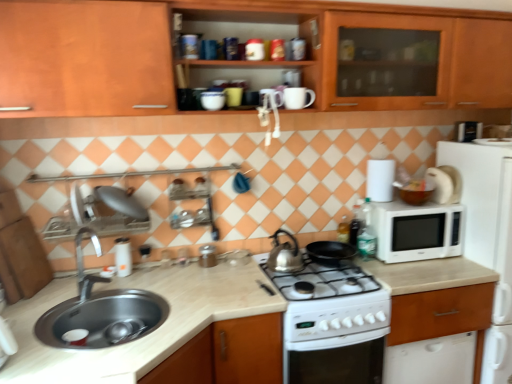
Identify the location of vacant point to the right of metallic silver canister at center, which is counted as the 2th appliance, starting from the left. The image size is (512, 384). (239, 262).